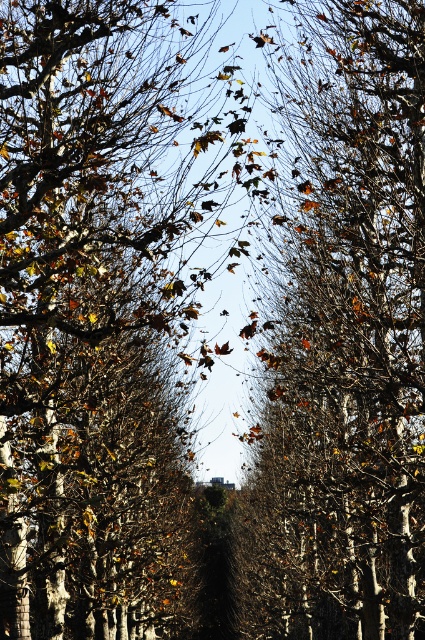
Measure the distance between brown leafy tree at center and brown matte tree at center.

brown leafy tree at center is 7.99 feet away from brown matte tree at center.

Is brown leafy tree at center to the left of brown matte tree at center from the viewer's perspective?

Correct, you'll find brown leafy tree at center to the left of brown matte tree at center.

Does point (175, 209) come farther from viewer compared to point (404, 136)?

No.

Locate an element on the screen. brown leafy tree at center is located at coordinates (99, 310).